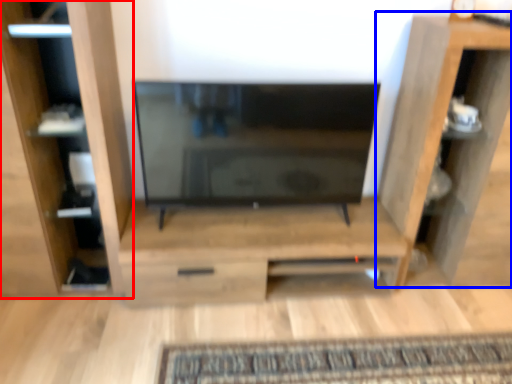
Question: Which of the following is the closest to the observer, furniture (highlighted by a red box) or shelf (highlighted by a blue box)?

Choices:
 (A) furniture
 (B) shelf

Answer: (A)